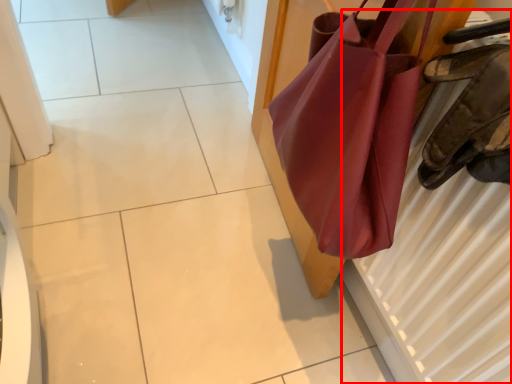
Question: Where is radiator (annotated by the red box) located in relation to handbag in the image?

Choices:
 (A) left
 (B) right

Answer: (B)